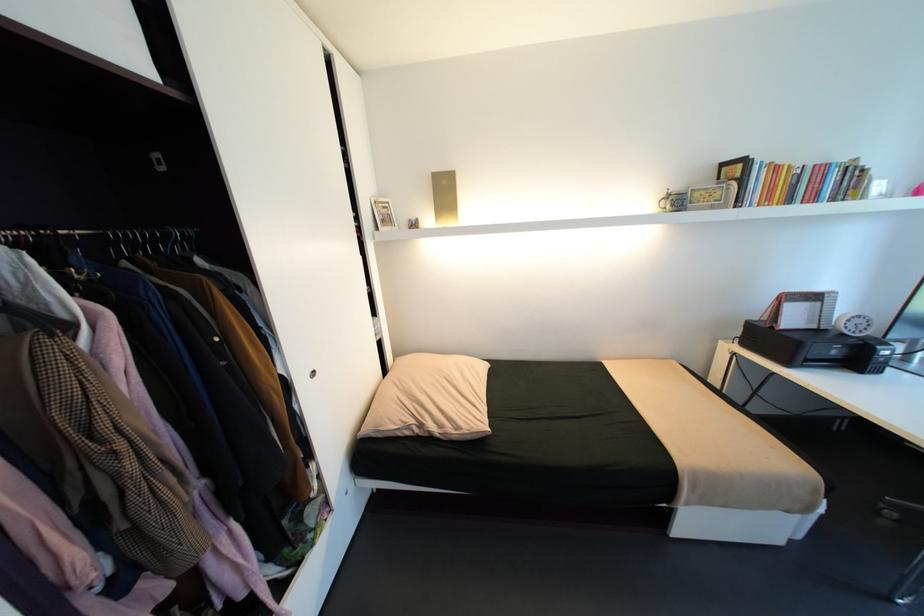
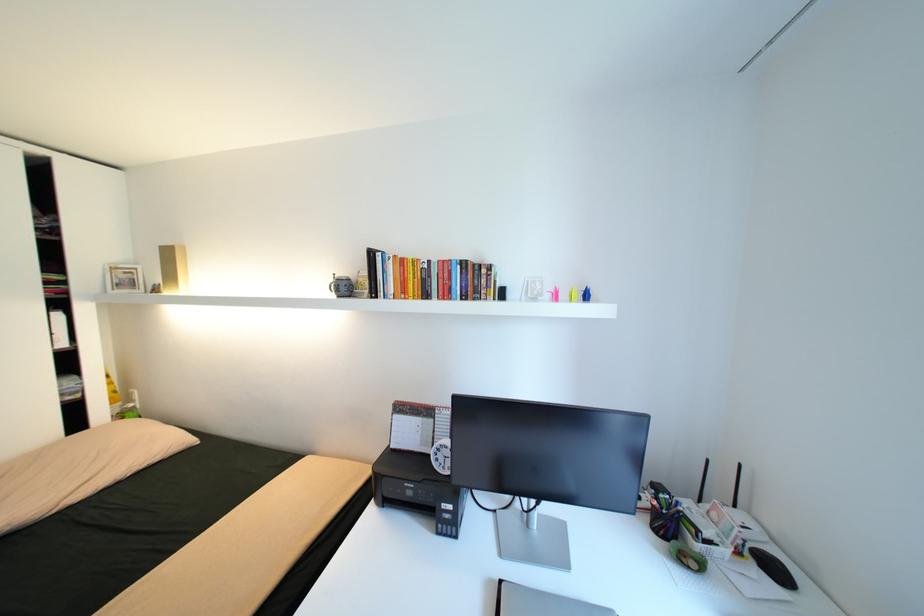
The point at (853, 328) is marked in the first image. Where is the corresponding point in the second image?

(444, 460)